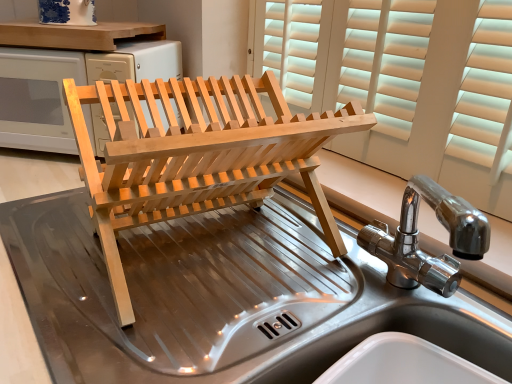
Question: From a real-world perspective, is stainless steel sink at center, which ranks as the first sink in bottom-to-top order, on natural wood dish rack at center?

Choices:
 (A) no
 (B) yes

Answer: (A)

Question: Is stainless steel sink at center, which ranks as the first sink in bottom-to-top order, not close to natural wood dish rack at center?

Choices:
 (A) no
 (B) yes

Answer: (A)

Question: Is stainless steel sink at center, which ranks as the first sink in bottom-to-top order, facing away from natural wood dish rack at center?

Choices:
 (A) yes
 (B) no

Answer: (B)

Question: From the image's perspective, does stainless steel sink at center, the second sink from the top, appear lower than natural wood dish rack at center?

Choices:
 (A) no
 (B) yes

Answer: (B)

Question: Can you confirm if stainless steel sink at center, the second sink from the top, is positioned to the right of natural wood dish rack at center?

Choices:
 (A) no
 (B) yes

Answer: (A)

Question: From the image's perspective, relative to polished stainless steel sink at center, placed as the 1th sink when sorted from top to bottom, is natural wood dish rack at center above or below?

Choices:
 (A) above
 (B) below

Answer: (A)

Question: In the image, is natural wood dish rack at center on the left side or the right side of polished stainless steel sink at center, the second sink from the bottom?

Choices:
 (A) right
 (B) left

Answer: (B)

Question: Considering the positions of natural wood dish rack at center and polished stainless steel sink at center, placed as the 1th sink when sorted from top to bottom, in the image, is natural wood dish rack at center bigger or smaller than polished stainless steel sink at center, placed as the 1th sink when sorted from top to bottom,?

Choices:
 (A) small
 (B) big

Answer: (B)

Question: From a real-world perspective, is natural wood dish rack at center positioned above or below polished stainless steel sink at center, the second sink from the bottom?

Choices:
 (A) above
 (B) below

Answer: (B)

Question: Is point (202, 233) positioned closer to the camera than point (259, 180)?

Choices:
 (A) closer
 (B) farther

Answer: (B)

Question: Based on their sizes in the image, would you say stainless steel sink at center, the second sink from the top, is bigger or smaller than natural wood dish rack at center?

Choices:
 (A) small
 (B) big

Answer: (B)

Question: From a real-world perspective, is stainless steel sink at center, which ranks as the first sink in bottom-to-top order, physically located above or below natural wood dish rack at center?

Choices:
 (A) below
 (B) above

Answer: (A)

Question: From the image's perspective, is stainless steel sink at center, which ranks as the first sink in bottom-to-top order, positioned above or below natural wood dish rack at center?

Choices:
 (A) below
 (B) above

Answer: (A)

Question: Considering the positions of natural wood dish rack at center and stainless steel sink at center, the second sink from the top, in the image, is natural wood dish rack at center taller or shorter than stainless steel sink at center, the second sink from the top,?

Choices:
 (A) short
 (B) tall

Answer: (A)

Question: Considering their positions, is natural wood dish rack at center located in front of or behind stainless steel sink at center, the second sink from the top?

Choices:
 (A) front
 (B) behind

Answer: (B)